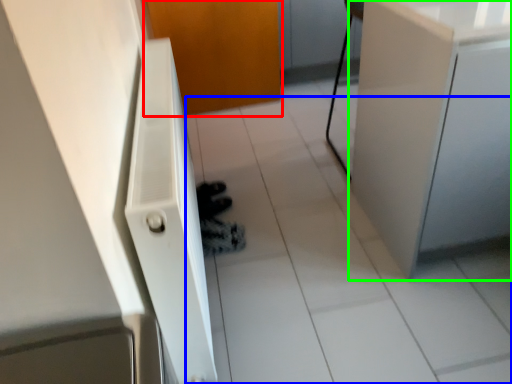
Question: Which is nearer to the door (highlighted by a red box)? tile (highlighted by a blue box) or cabinetry (highlighted by a green box).

Choices:
 (A) tile
 (B) cabinetry

Answer: (A)